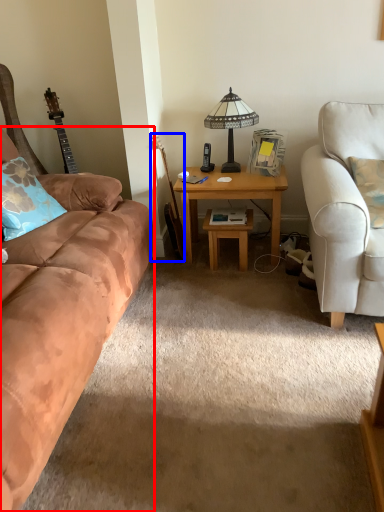
Question: Which object appears farthest to the camera in this image, studio couch (highlighted by a red box) or guitar (highlighted by a blue box)?

Choices:
 (A) studio couch
 (B) guitar

Answer: (B)